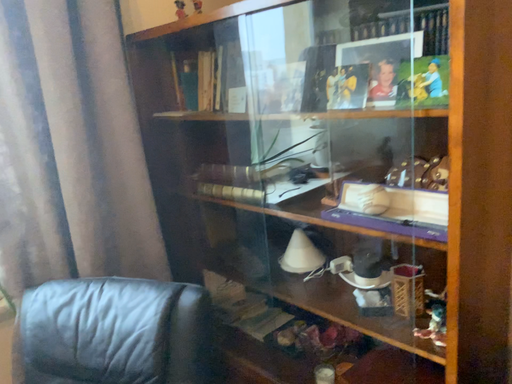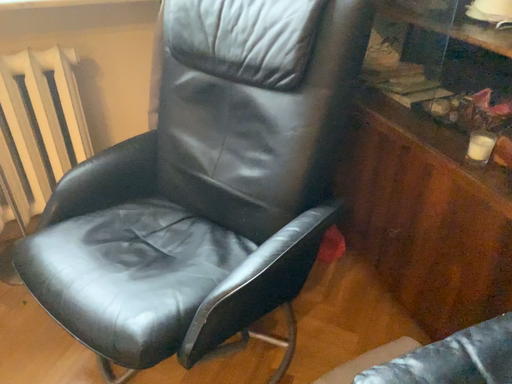
Question: How did the camera likely rotate when shooting the video?

Choices:
 (A) rotated left
 (B) rotated right

Answer: (A)